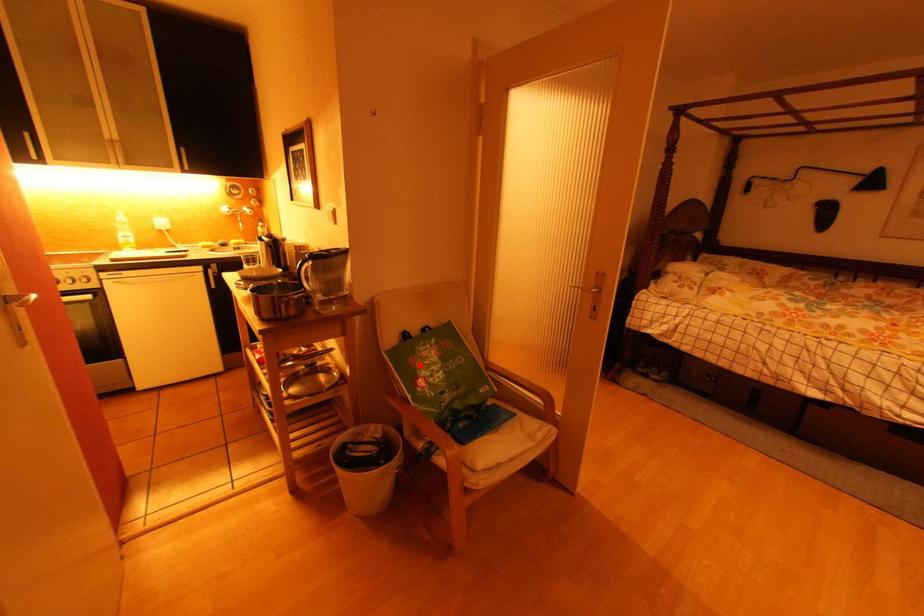
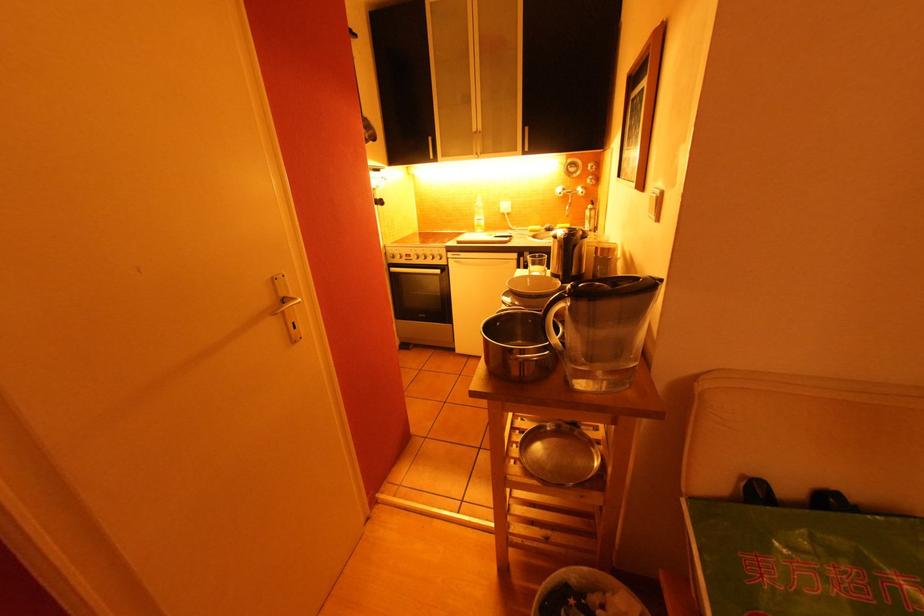
Question: I am providing you with two images of the same scene from different viewpoints. Image1 has a red point marked. In image2, the corresponding 3D location appears at what relative position? Reply with the corresponding letter.

Choices:
 (A) Closer
 (B) Farther

Answer: (A)